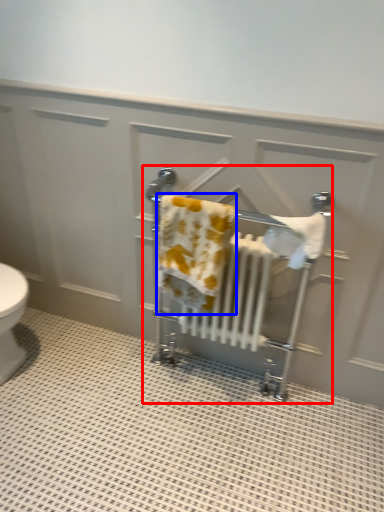
Question: Which point is further to the camera, baby carriage (highlighted by a red box) or bath towel (highlighted by a blue box)?

Choices:
 (A) baby carriage
 (B) bath towel

Answer: (A)